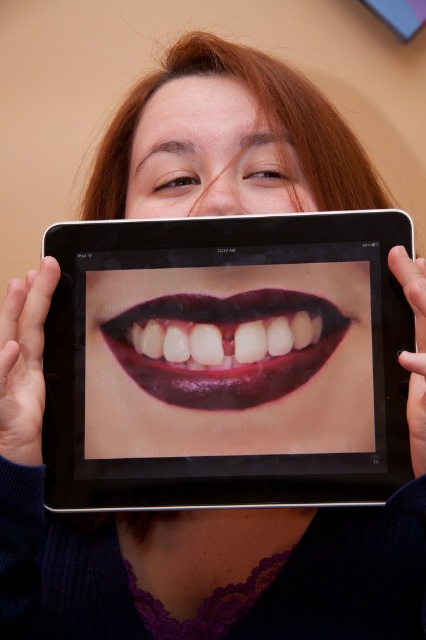
You are a photographer adjusting the focus on your camera. The subject is holding a tablet showing a closeup of their mouth with red lipstick. There is a point at coordinates point (192, 333) that you need to focus on. Given that the point is 16.72 inches away from the camera, can you confirm if this distance is within the typical focus range for portrait photography?

The point at (192, 333) is 16.72 inches away from the camera. In portrait photography, typical focus ranges start around 3 feet or 36 inches. Since 16.72 inches is less than 36 inches, this distance may be too close for standard portrait focus ranges, potentially causing the subject to be out of focus.

You are a photographer adjusting the composition of a portrait. You have two points marked on your screen at coordinates point (210,316) and point (189,116). Which point is closer to the viewer in this image?

Point (210,316) is in front of point (189,116), so it is closer to the viewer.

Consider the image. You are a photographer adjusting the lighting for a closeup shot of a tablet screen and a person. The tablet is displaying an image of a mouth with red lipstick. You need to ensure that the tablet and the person are properly positioned so that the reflection on the tablet screen clearly shows the person. Based on the scene, will the reflection of the smooth skin at center be visible on the black glossy tablet at center?

The black glossy tablet at center is 5.07 inches away from smooth skin at center. Since the tablet is glossy and the skin is close, the reflection of the smooth skin at center is likely visible on the black glossy tablet at center.